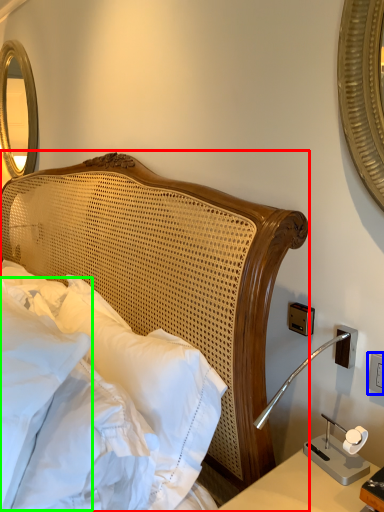
Question: Considering the real-world distances, which object is closest to bed (highlighted by a red box)? electric outlet (highlighted by a blue box) or pillow (highlighted by a green box).

Choices:
 (A) electric outlet
 (B) pillow

Answer: (B)